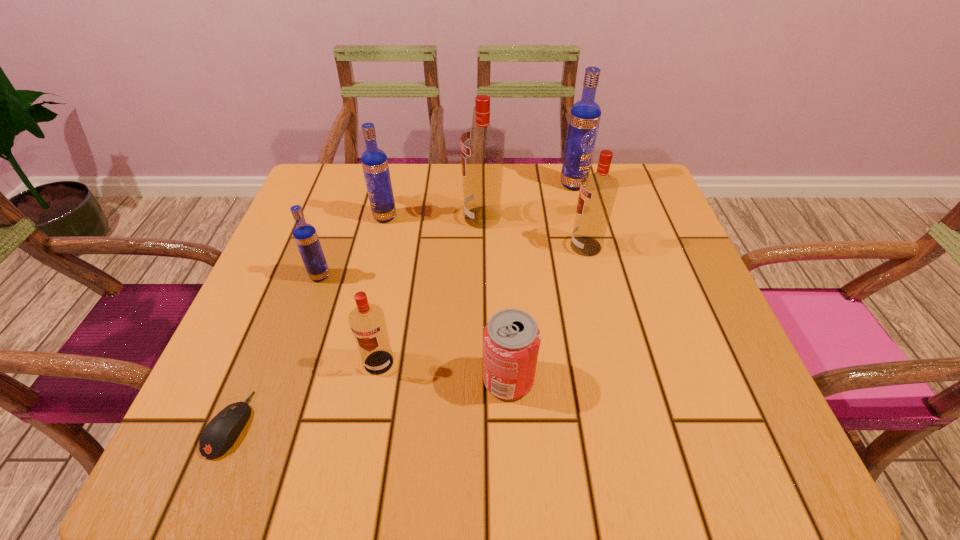
Image resolution: width=960 pixels, height=540 pixels. What are the coordinates of `the leftmost red vodka` in the screenshot? It's located at (367, 321).

Locate an element on the screen. the nearest red vodka is located at coordinates (367, 321).

The height and width of the screenshot is (540, 960). Identify the location of the second shortest object. (511, 339).

This screenshot has height=540, width=960. Find the location of `computer mouse`. computer mouse is located at coordinates (219, 435).

Where is `the shortest object`? the shortest object is located at coordinates (219, 435).

Find the location of a particular element. The height and width of the screenshot is (540, 960). free space located on the right of the rightmost blue vodka is located at coordinates (612, 184).

In order to click on free location located 0.090m on the front label of the fourth vodka from left to right in this screenshot , I will do `click(426, 217)`.

Locate an element on the screen. vacant area located on the front label of the fourth vodka from left to right is located at coordinates (x=414, y=217).

The height and width of the screenshot is (540, 960). Find the location of `free space located 0.120m on the front label of the fourth vodka from left to right`. free space located 0.120m on the front label of the fourth vodka from left to right is located at coordinates (414, 217).

This screenshot has width=960, height=540. Identify the location of vacant area situated 0.340m on the right of the second biggest blue vodka. (536, 217).